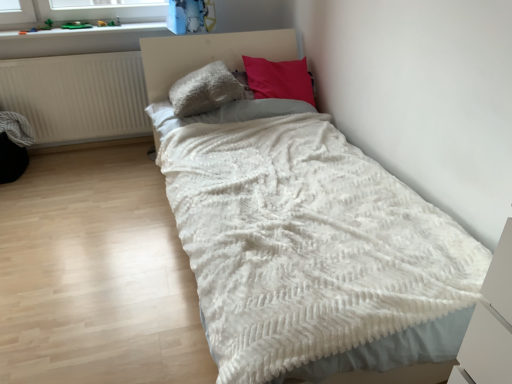
Describe the element at coordinates (86, 30) in the screenshot. I see `smooth plastic toys at upper left` at that location.

How much space does velvet-like pink pillow at upper center, the 2th pillow positioned from the left, occupy vertically?

The height of velvet-like pink pillow at upper center, the 2th pillow positioned from the left, is 38.72 centimeters.

What is the approximate width of fluffy gray pillow at center, the first pillow from the left?

The width of fluffy gray pillow at center, the first pillow from the left, is 18.04 inches.

The width and height of the screenshot is (512, 384). What are the coordinates of `white matte radiator at left` in the screenshot? It's located at (77, 96).

In order to click on white fluffy blanket at center in this screenshot , I will do `click(211, 54)`.

Is velvet-like pink pillow at upper center, which ranks as the first pillow in right-to-left order, positioned far away from white fluffy blanket at center?

No, there isn't a large distance between velvet-like pink pillow at upper center, which ranks as the first pillow in right-to-left order, and white fluffy blanket at center.

From the image's perspective, which is below, velvet-like pink pillow at upper center, which ranks as the first pillow in right-to-left order, or white fluffy blanket at center?

white fluffy blanket at center is shown below in the image.

Is velvet-like pink pillow at upper center, the 2th pillow positioned from the left, bigger than white fluffy blanket at center?

Actually, velvet-like pink pillow at upper center, the 2th pillow positioned from the left, might be smaller than white fluffy blanket at center.

From a real-world perspective, who is located lower, velvet-like pink pillow at upper center, the 2th pillow positioned from the left, or white fluffy blanket at center?

white fluffy blanket at center, from a real-world perspective.

In terms of height, does white matte radiator at left look taller or shorter compared to velvet-like pink pillow at upper center, the 2th pillow positioned from the left?

Clearly, white matte radiator at left is taller compared to velvet-like pink pillow at upper center, the 2th pillow positioned from the left.

Measure the distance from white matte radiator at left to velvet-like pink pillow at upper center, which ranks as the first pillow in right-to-left order.

white matte radiator at left is 3.85 feet from velvet-like pink pillow at upper center, which ranks as the first pillow in right-to-left order.

Considering the relative positions of white matte radiator at left and velvet-like pink pillow at upper center, which ranks as the first pillow in right-to-left order, in the image provided, is white matte radiator at left to the right of velvet-like pink pillow at upper center, which ranks as the first pillow in right-to-left order, from the viewer's perspective?

In fact, white matte radiator at left is to the left of velvet-like pink pillow at upper center, which ranks as the first pillow in right-to-left order.

Is white matte radiator at left further to the viewer compared to velvet-like pink pillow at upper center, which ranks as the first pillow in right-to-left order?

Yes, it is.

From the image's perspective, relative to fluffy gray pillow at center, the first pillow from the left, is white fluffy blanket at center above or below?

white fluffy blanket at center is below fluffy gray pillow at center, the first pillow from the left.

Considering the points (439, 378) and (203, 87), which point is in front, point (439, 378) or point (203, 87)?

Point (439, 378)

Based on the photo, is white fluffy blanket at center turned away from fluffy gray pillow at center, positioned as the second pillow in right-to-left order?

Yes, white fluffy blanket at center is facing away from fluffy gray pillow at center, positioned as the second pillow in right-to-left order.

Considering the relative positions of white fluffy blanket at center and fluffy gray pillow at center, positioned as the second pillow in right-to-left order, in the image provided, is white fluffy blanket at center to the right of fluffy gray pillow at center, positioned as the second pillow in right-to-left order, from the viewer's perspective?

Yes, white fluffy blanket at center is to the right of fluffy gray pillow at center, positioned as the second pillow in right-to-left order.

Is white fluffy blanket at center in front of or behind white matte radiator at left in the image?

white fluffy blanket at center is positioned closer to the viewer than white matte radiator at left.

In order to click on radiator located above the white fluffy blanket at center (from the image's perspective) in this screenshot , I will do `click(77, 96)`.

Would you consider white fluffy blanket at center to be distant from white matte radiator at left?

No, there isn't a large distance between white fluffy blanket at center and white matte radiator at left.

Based on the photo, considering the positions of objects white fluffy blanket at center and white matte radiator at left in the image provided, who is more to the right, white fluffy blanket at center or white matte radiator at left?

From the viewer's perspective, white fluffy blanket at center appears more on the right side.

Identify the location of bed that appears in front of the smooth plastic toys at upper left. 211,54.

From a real-world perspective, who is located lower, smooth plastic toys at upper left or white fluffy blanket at center?

white fluffy blanket at center.

Considering the relative positions of smooth plastic toys at upper left and white fluffy blanket at center in the image provided, is smooth plastic toys at upper left behind white fluffy blanket at center?

Yes, smooth plastic toys at upper left is further from the viewer.

Is smooth plastic toys at upper left surrounding fluffy gray pillow at center, the first pillow from the left?

No.

Which of these two, smooth plastic toys at upper left or fluffy gray pillow at center, positioned as the second pillow in right-to-left order, stands taller?

Standing taller between the two is fluffy gray pillow at center, positioned as the second pillow in right-to-left order.

From the image's perspective, does smooth plastic toys at upper left appear higher than fluffy gray pillow at center, positioned as the second pillow in right-to-left order?

Yes, from the image's perspective, smooth plastic toys at upper left is over fluffy gray pillow at center, positioned as the second pillow in right-to-left order.

Between smooth plastic toys at upper left and fluffy gray pillow at center, positioned as the second pillow in right-to-left order, which one is positioned behind?

smooth plastic toys at upper left.

Is velvet-like pink pillow at upper center, which ranks as the first pillow in right-to-left order, taller or shorter than white matte radiator at left?

Considering their sizes, velvet-like pink pillow at upper center, which ranks as the first pillow in right-to-left order, has less height than white matte radiator at left.

Is velvet-like pink pillow at upper center, the 2th pillow positioned from the left, aimed at white matte radiator at left?

No, velvet-like pink pillow at upper center, the 2th pillow positioned from the left, is not facing towards white matte radiator at left.

Is velvet-like pink pillow at upper center, the 2th pillow positioned from the left, wider or thinner than white matte radiator at left?

In the image, velvet-like pink pillow at upper center, the 2th pillow positioned from the left, appears to be wider than white matte radiator at left.

From a real-world perspective, is velvet-like pink pillow at upper center, which ranks as the first pillow in right-to-left order, located beneath white matte radiator at left?

Actually, velvet-like pink pillow at upper center, which ranks as the first pillow in right-to-left order, is physically above white matte radiator at left in the real world.

This screenshot has height=384, width=512. I want to click on bed that appears on the left of velvet-like pink pillow at upper center, which ranks as the first pillow in right-to-left order, so click(x=211, y=54).

The image size is (512, 384). Identify the location of the 1st pillow in front of the white matte radiator at left. (279, 79).

Looking at the image, which one is located further to velvet-like pink pillow at upper center, which ranks as the first pillow in right-to-left order, white matte radiator at left or white fluffy blanket at center?

white matte radiator at left lies further to velvet-like pink pillow at upper center, which ranks as the first pillow in right-to-left order, than the other object.

Looking at the image, which one is located closer to fluffy gray pillow at center, positioned as the second pillow in right-to-left order, smooth plastic toys at upper left or white fluffy blanket at center?

The object closer to fluffy gray pillow at center, positioned as the second pillow in right-to-left order, is white fluffy blanket at center.

From the image, which object appears to be nearer to white fluffy blanket at center, white matte radiator at left or velvet-like pink pillow at upper center, which ranks as the first pillow in right-to-left order?

velvet-like pink pillow at upper center, which ranks as the first pillow in right-to-left order.

In the scene shown: Looking at the image, which one is located closer to velvet-like pink pillow at upper center, the 2th pillow positioned from the left, white matte radiator at left or fluffy gray pillow at center, positioned as the second pillow in right-to-left order?

fluffy gray pillow at center, positioned as the second pillow in right-to-left order, lies closer to velvet-like pink pillow at upper center, the 2th pillow positioned from the left, than the other object.

Looking at the image, which one is located closer to velvet-like pink pillow at upper center, the 2th pillow positioned from the left, fluffy gray pillow at center, positioned as the second pillow in right-to-left order, or smooth plastic toys at upper left?

fluffy gray pillow at center, positioned as the second pillow in right-to-left order.

When comparing their distances from white matte radiator at left, does white fluffy blanket at center or smooth plastic toys at upper left seem closer?

The object closer to white matte radiator at left is smooth plastic toys at upper left.

Looking at this image, looking at the image, which one is located closer to white matte radiator at left, smooth plastic toys at upper left or velvet-like pink pillow at upper center, the 2th pillow positioned from the left?

Among the two, smooth plastic toys at upper left is located nearer to white matte radiator at left.

Estimate the real-world distances between objects in this image. Which object is closer to white fluffy blanket at center, smooth plastic toys at upper left or white matte radiator at left?

smooth plastic toys at upper left lies closer to white fluffy blanket at center than the other object.

The width and height of the screenshot is (512, 384). What are the coordinates of `pillow positioned between white fluffy blanket at center and velvet-like pink pillow at upper center, which ranks as the first pillow in right-to-left order, from near to far` in the screenshot? It's located at (207, 90).

At what (x,y) coordinates should I click in order to perform the action: click on window sill between white matte radiator at left and fluffy gray pillow at center, positioned as the second pillow in right-to-left order, from left to right. Please return your answer as a coordinate pair (x, y). The width and height of the screenshot is (512, 384). Looking at the image, I should click on (86, 30).

Identify the location of pillow located between smooth plastic toys at upper left and velvet-like pink pillow at upper center, the 2th pillow positioned from the left, in the left-right direction. (207, 90).

Where is `pillow between white matte radiator at left and velvet-like pink pillow at upper center, which ranks as the first pillow in right-to-left order, in the horizontal direction`? pillow between white matte radiator at left and velvet-like pink pillow at upper center, which ranks as the first pillow in right-to-left order, in the horizontal direction is located at coordinates (207, 90).